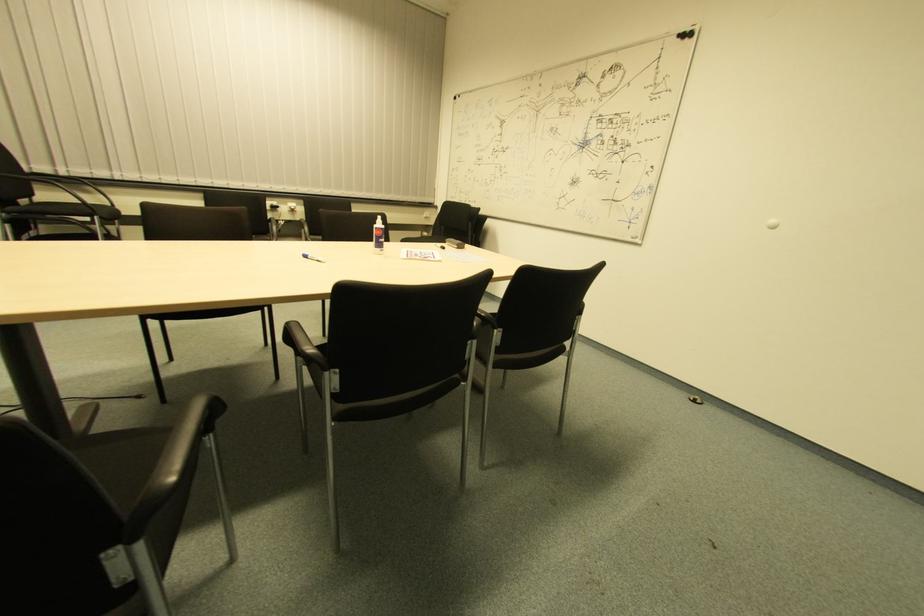
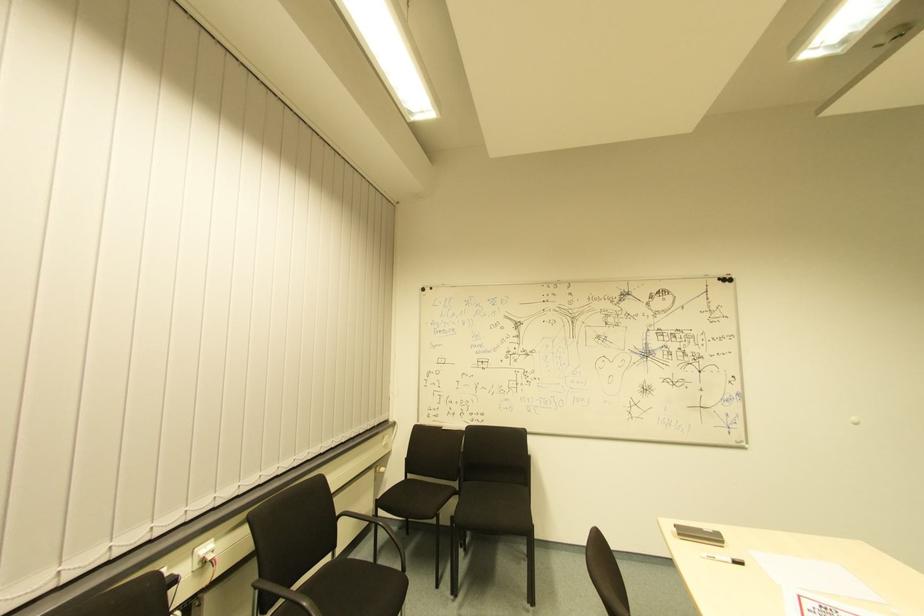
Where in the second image is the point corresponding to point (686, 42) from the first image?

(725, 286)